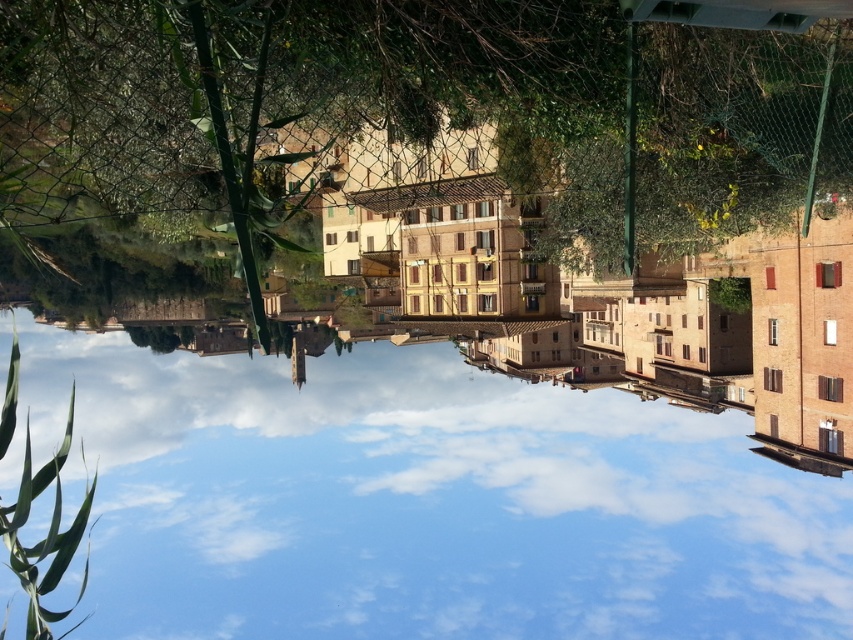
Question: Which of the following is the closest to the observer?

Choices:
 (A) (762, 625)
 (B) (556, 22)

Answer: (B)

Question: Does transparent glass water at center have a smaller size compared to green leafy tree at upper center?

Choices:
 (A) no
 (B) yes

Answer: (A)

Question: Which point is closer to the camera?

Choices:
 (A) (4, 10)
 (B) (656, 465)

Answer: (A)

Question: Considering the relative positions of transparent glass water at center and green leafy tree at upper center in the image provided, where is transparent glass water at center located with respect to green leafy tree at upper center?

Choices:
 (A) below
 (B) above

Answer: (A)

Question: Among these objects, which one is nearest to the camera?

Choices:
 (A) green leafy tree at upper center
 (B) transparent glass water at center

Answer: (A)

Question: Does transparent glass water at center appear over green leafy tree at upper center?

Choices:
 (A) yes
 (B) no

Answer: (B)